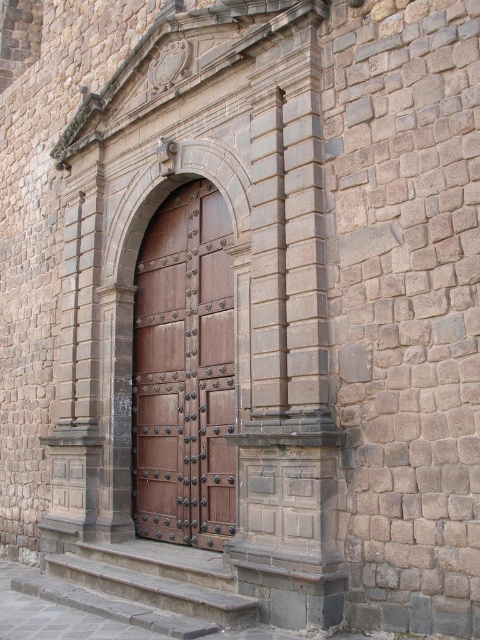
Question: Is brown polished wood door at center below gray stone steps at lower center?

Choices:
 (A) yes
 (B) no

Answer: (B)

Question: Where is brown polished wood door at center located in relation to gray stone steps at lower center in the image?

Choices:
 (A) above
 (B) below

Answer: (A)

Question: Among these points, which one is nearest to the camera?

Choices:
 (A) (159, 476)
 (B) (168, 545)

Answer: (B)

Question: Is brown polished wood door at center to the left of gray stone steps at lower center from the viewer's perspective?

Choices:
 (A) no
 (B) yes

Answer: (A)